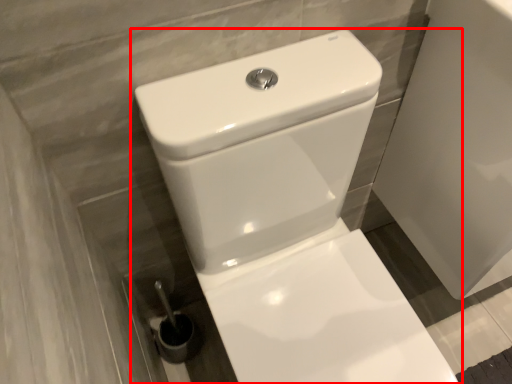
Question: From the image's perspective, where is toilet (annotated by the red box) located in relation to porcelain in the image?

Choices:
 (A) below
 (B) above

Answer: (A)